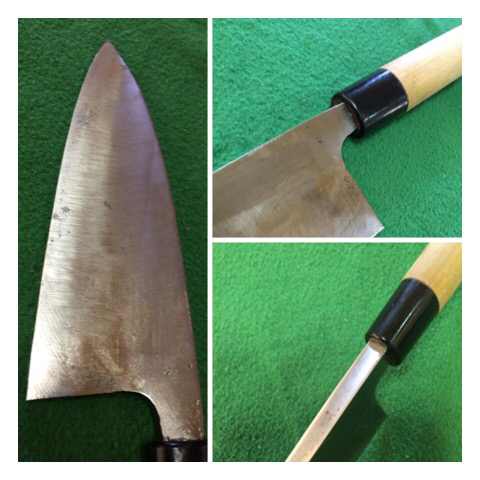
I want to click on round wooden handle, so click(438, 69), click(443, 274).